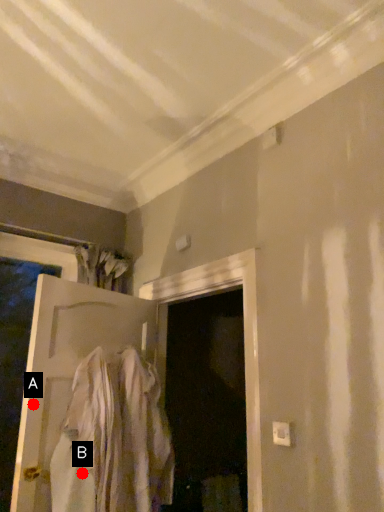
Question: Two points are circled on the image, labeled by A and B beside each circle. Among these points, which one is farthest from the camera?

Choices:
 (A) A is further
 (B) B is further

Answer: (A)